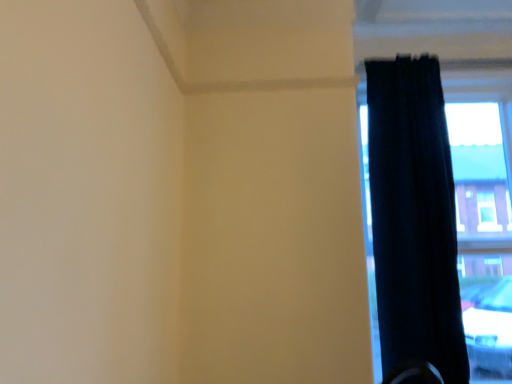
At what (x,y) coordinates should I click in order to perform the action: click on dark blue fabric curtain at right. Please return your answer as a coordinate pair (x, y). Image resolution: width=512 pixels, height=384 pixels. Looking at the image, I should click on (414, 224).

Describe the element at coordinates (414, 224) in the screenshot. This screenshot has height=384, width=512. I see `dark blue fabric curtain at right` at that location.

Where is `dark blue fabric curtain at right`? dark blue fabric curtain at right is located at coordinates (414, 224).